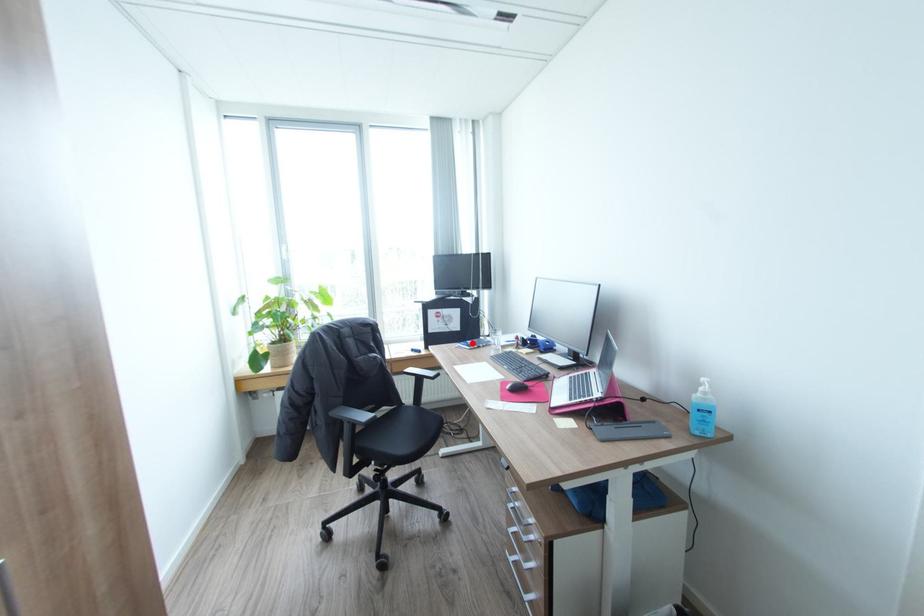
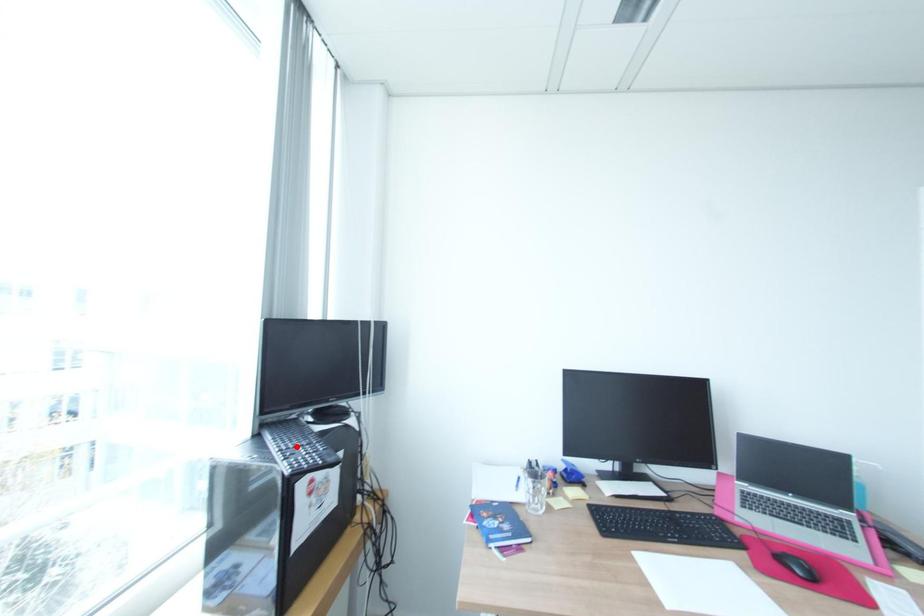
I am providing you with two images of the same scene from different viewpoints. A red point is marked on the first image and another point is marked on the second image. Is the marked point in image1 the same physical position as the marked point in image2?

No